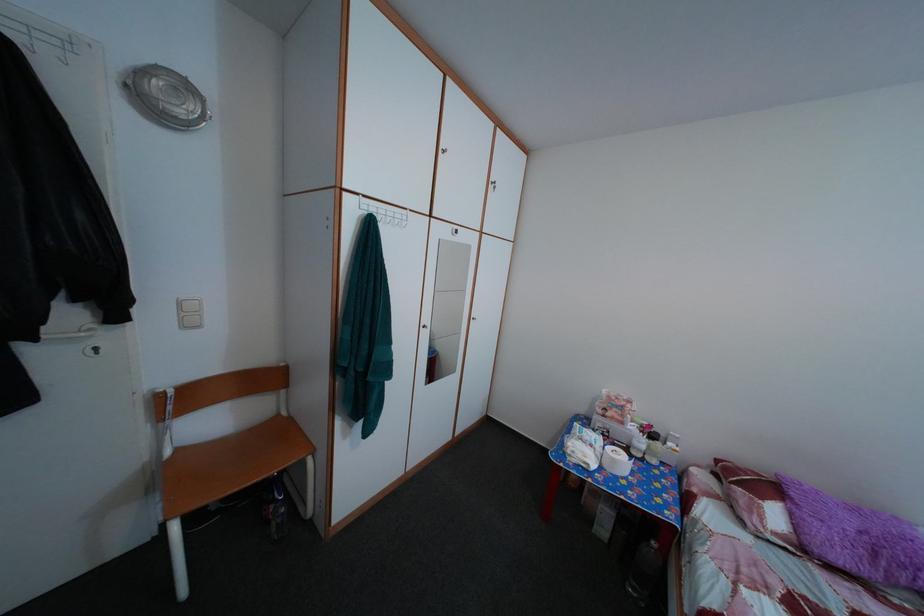
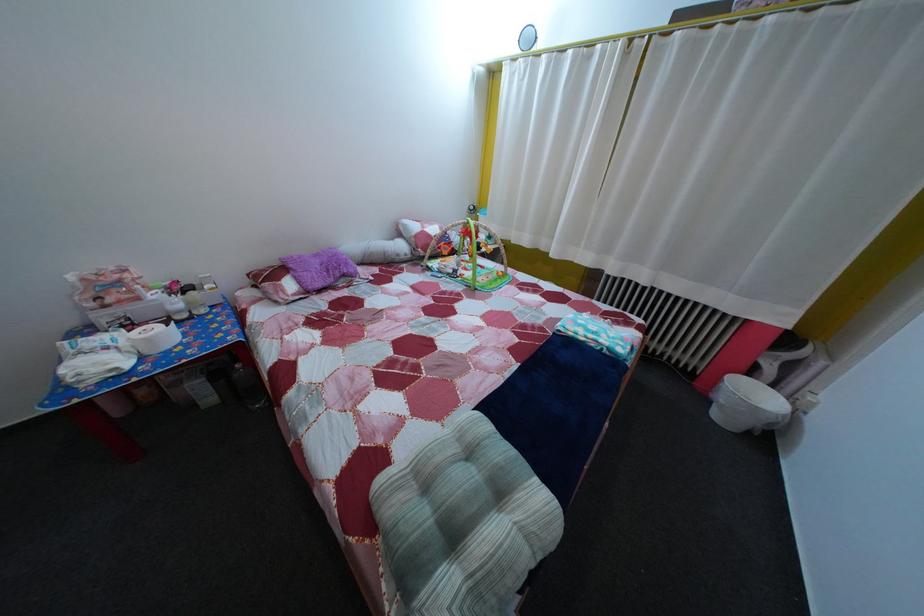
Where in the second image is the point corresponding to [679,453] from the first image?

(216, 294)